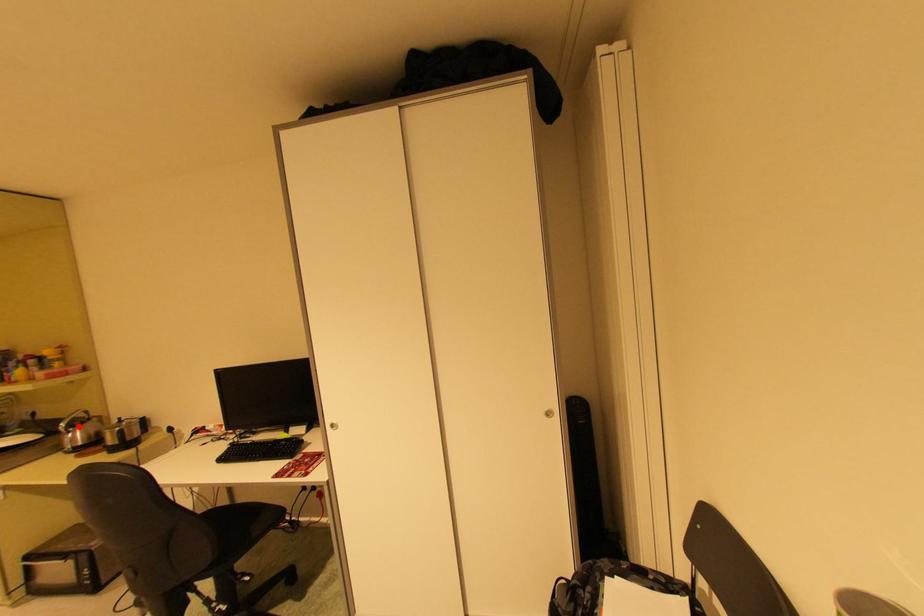
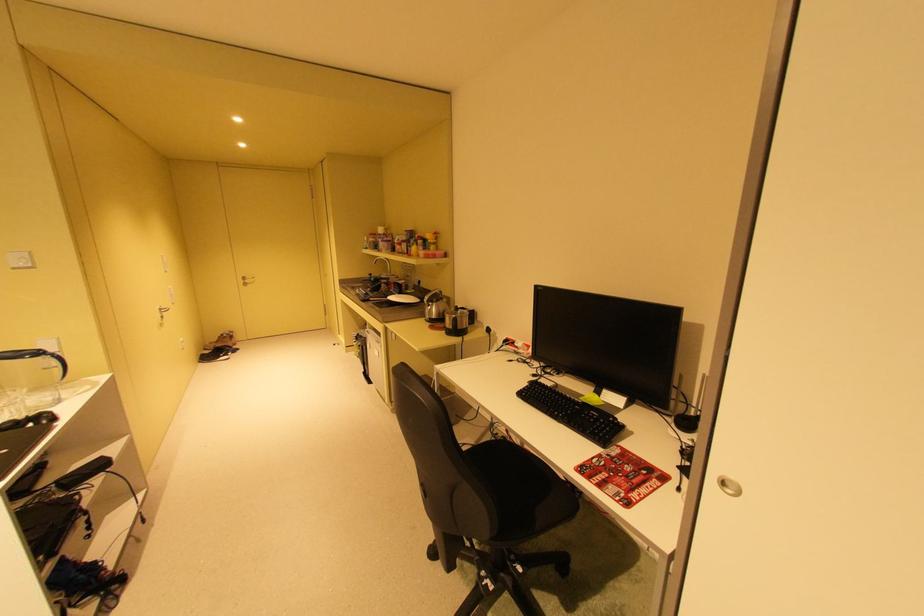
Find the pixel in the second image that matches the highlighted location in the first image.

(439, 302)